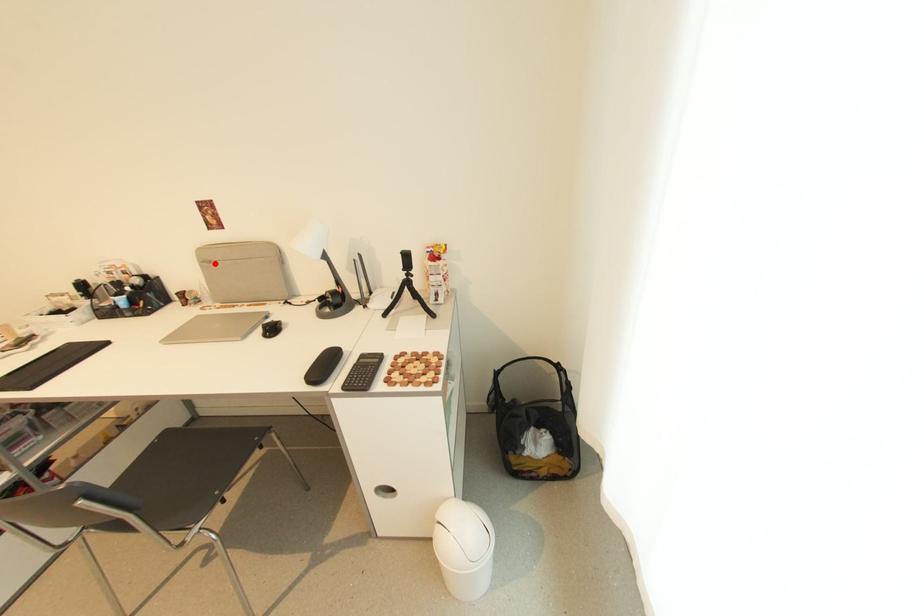
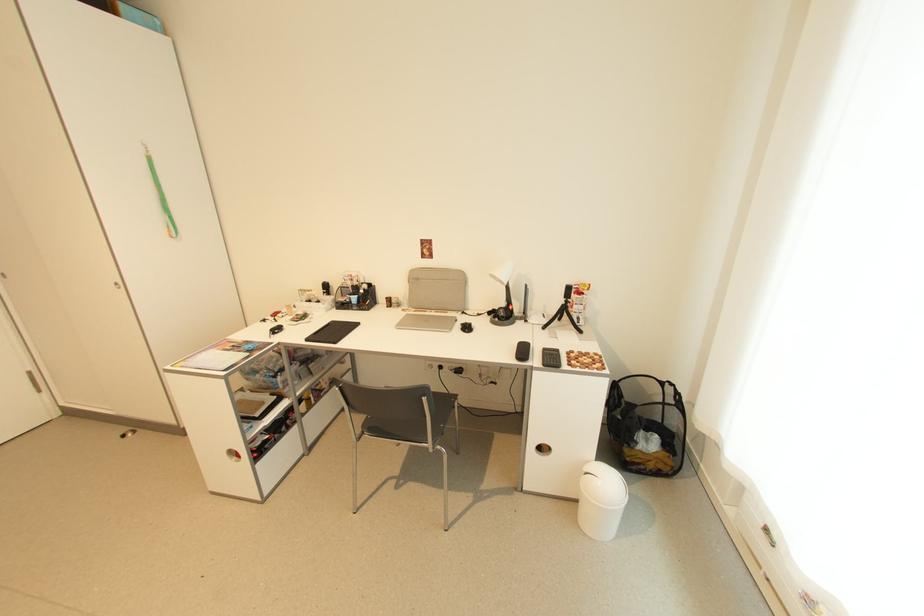
Where in the second image is the point corresponding to the highlighted location from the first image?

(422, 281)